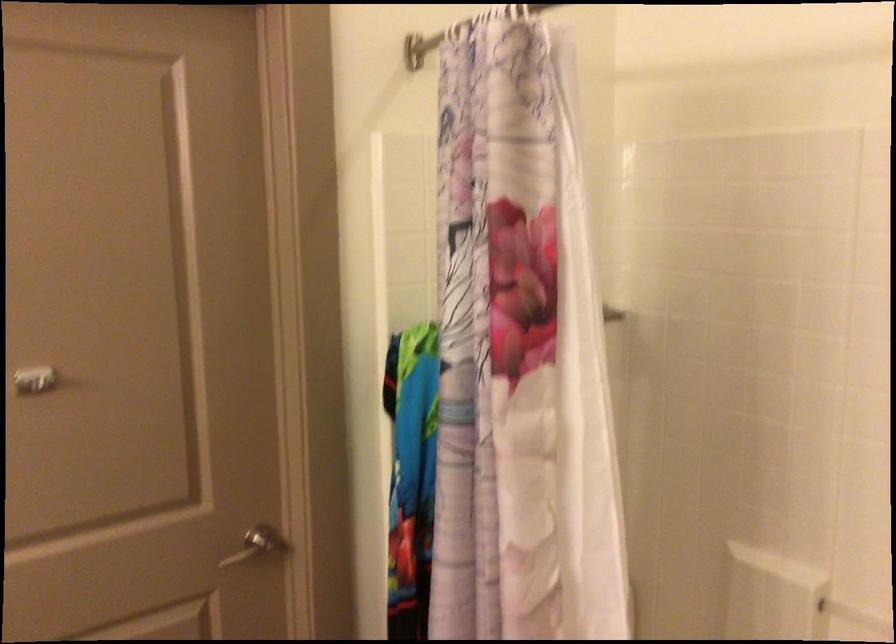
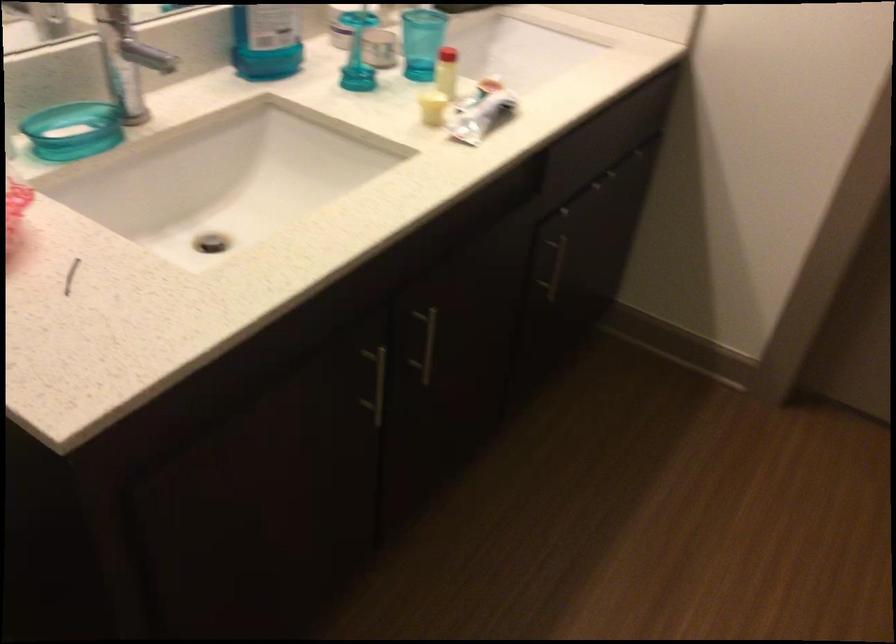
The images are taken continuously from a first-person perspective. In which direction is your viewpoint rotating?

The camera rotated toward left-down.